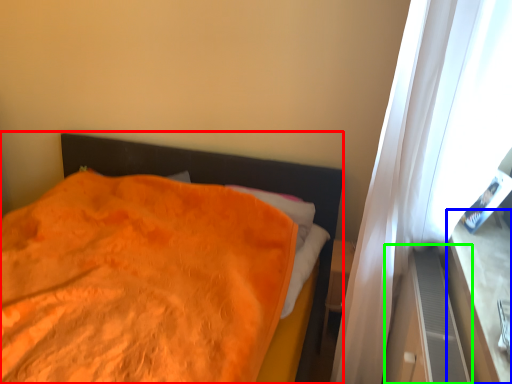
Question: Which is nearer to the bed (highlighted by a red box)? window sill (highlighted by a blue box) or dresser (highlighted by a green box).

Choices:
 (A) window sill
 (B) dresser

Answer: (B)